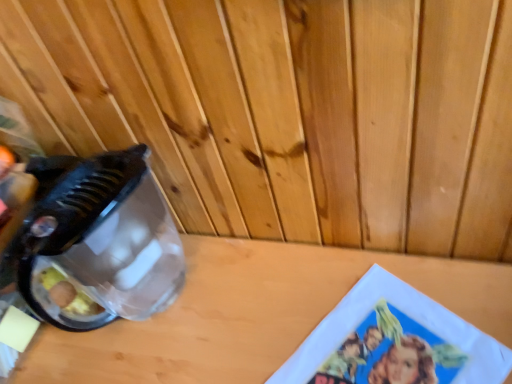
I want to click on unoccupied region to the right of transparent plastic blender at left, so (254, 289).